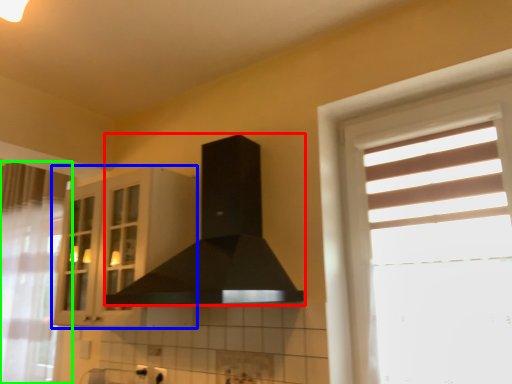
Question: Estimate the real-world distances between objects in this image. Which object is farther from fume hood (highlighted by a red box), cabinetry (highlighted by a blue box) or curtain (highlighted by a green box)?

Choices:
 (A) cabinetry
 (B) curtain

Answer: (B)